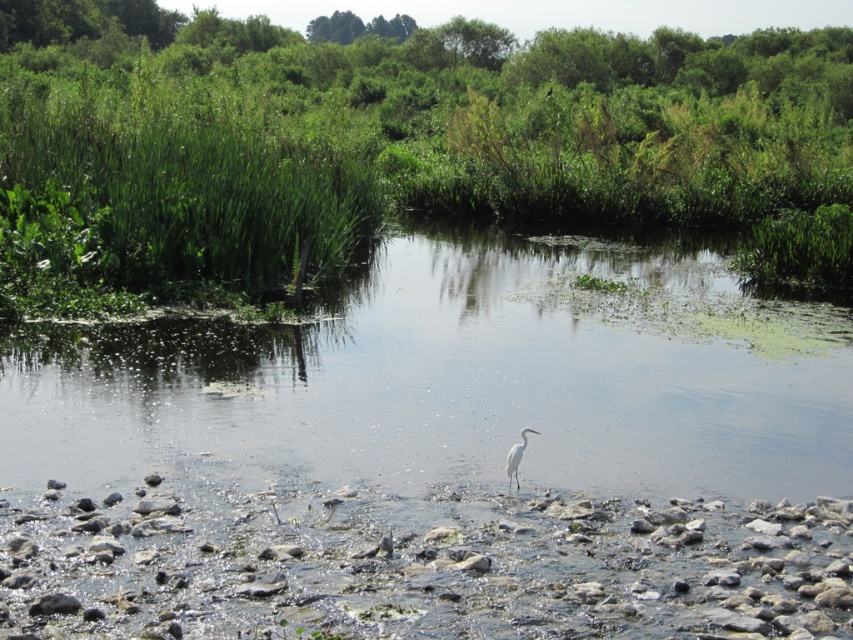
Question: Which of the following is the closest to the observer?

Choices:
 (A) white matte bird at center
 (B) green grass at center

Answer: (A)

Question: Does green grass at center appear on the right side of white matte bird at center?

Choices:
 (A) no
 (B) yes

Answer: (B)

Question: Where is green grass at center located in relation to white matte bird at center in the image?

Choices:
 (A) left
 (B) right

Answer: (B)

Question: Which object is closer to the camera taking this photo?

Choices:
 (A) white matte bird at center
 (B) green grass at center

Answer: (A)

Question: Is green grass at center to the left of white matte bird at center from the viewer's perspective?

Choices:
 (A) yes
 (B) no

Answer: (B)